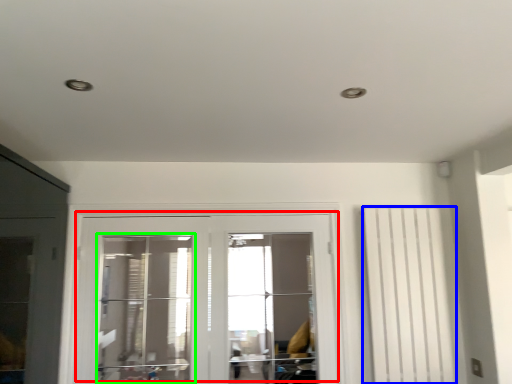
Question: Estimate the real-world distances between objects in this image. Which object is closer to door (highlighted by a red box), curtain (highlighted by a blue box) or window (highlighted by a green box)?

Choices:
 (A) curtain
 (B) window

Answer: (B)